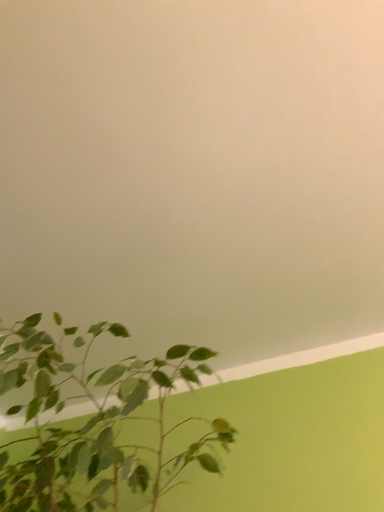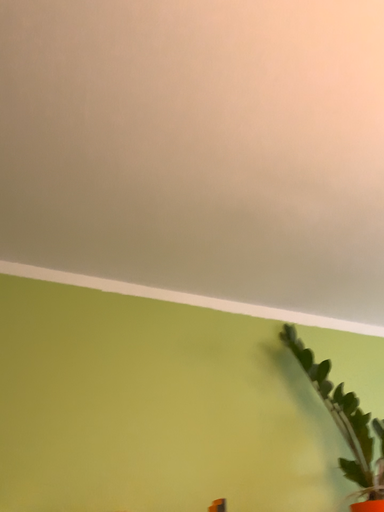
Question: How did the camera likely rotate when shooting the video?

Choices:
 (A) rotated upward
 (B) rotated downward

Answer: (B)